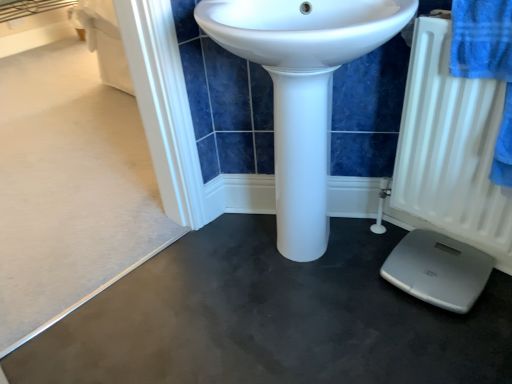
Question: Is point (465, 218) positioned closer to the camera than point (310, 165)?

Choices:
 (A) closer
 (B) farther

Answer: (B)

Question: In terms of height, does white matte radiator at right look taller or shorter compared to white glossy sink at center?

Choices:
 (A) short
 (B) tall

Answer: (A)

Question: Visually, is white matte radiator at right positioned to the left or to the right of white glossy sink at center?

Choices:
 (A) right
 (B) left

Answer: (A)

Question: Would you say white glossy sink at center is to the left or to the right of white matte radiator at right in the picture?

Choices:
 (A) right
 (B) left

Answer: (B)

Question: Is white glossy sink at center inside the boundaries of white matte radiator at right, or outside?

Choices:
 (A) outside
 (B) inside

Answer: (A)

Question: Looking at their shapes, would you say white glossy sink at center is wider or thinner than white matte radiator at right?

Choices:
 (A) wide
 (B) thin

Answer: (A)

Question: Is white glossy sink at center bigger or smaller than white matte radiator at right?

Choices:
 (A) small
 (B) big

Answer: (B)